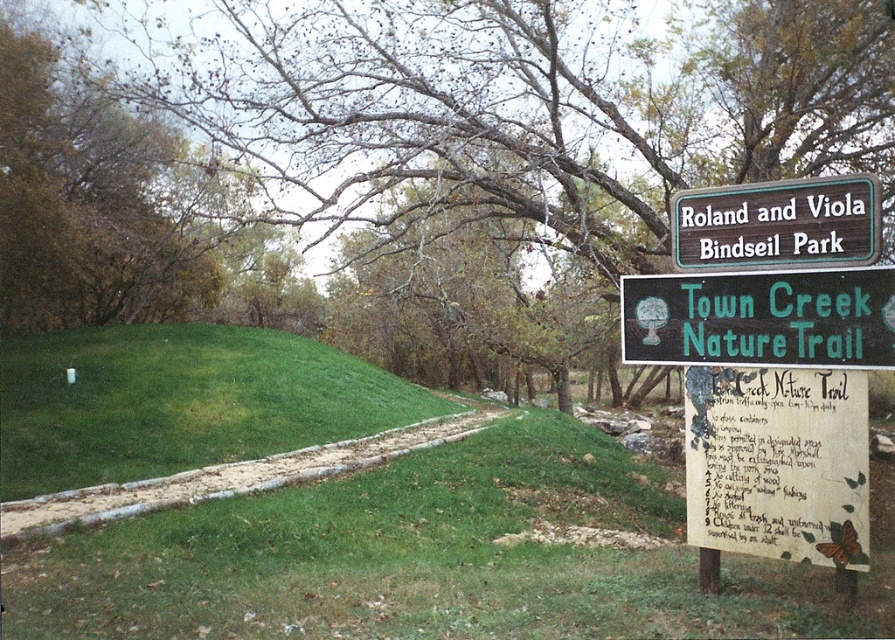
Who is more forward, (x=61, y=346) or (x=783, y=339)?

Point (x=783, y=339)

Is point (158, 396) less distant than point (669, 349)?

No.

Who is more distant from viewer, (240, 371) or (870, 284)?

Point (240, 371)

Identify the location of green grassy hillside at lower left. This screenshot has height=640, width=895. (181, 401).

Between green grassy hillside at lower left and green wooden sign at upper center, which one has more height?

With more height is green grassy hillside at lower left.

Does point (314, 372) come farther from viewer compared to point (678, 209)?

Yes.

Does point (33, 451) come behind point (802, 250)?

Yes, point (33, 451) is farther from viewer.

Find the location of a particular element. This screenshot has width=895, height=640. green grassy hillside at lower left is located at coordinates (181, 401).

In the scene shown: Who is positioned more to the right, green plastic sign at right or green wooden sign at upper center?

green wooden sign at upper center is more to the right.

Can you confirm if green plastic sign at right is positioned to the right of green wooden sign at upper center?

In fact, green plastic sign at right is to the left of green wooden sign at upper center.

Describe the element at coordinates (761, 317) in the screenshot. I see `green plastic sign at right` at that location.

Where is `green plastic sign at right`? The height and width of the screenshot is (640, 895). green plastic sign at right is located at coordinates [761, 317].